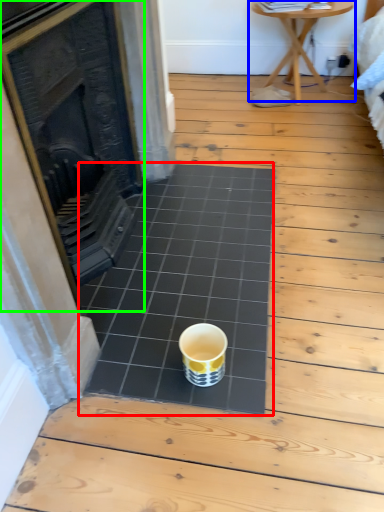
Question: Estimate the real-world distances between objects in this image. Which object is closer to ceramic tile (highlighted by a red box), table (highlighted by a blue box) or fireplace (highlighted by a green box)?

Choices:
 (A) table
 (B) fireplace

Answer: (B)